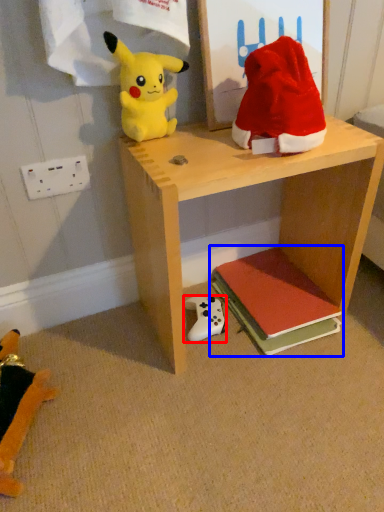
Question: Which object is closer to the camera taking this photo, toy (highlighted by a red box) or book (highlighted by a blue box)?

Choices:
 (A) toy
 (B) book

Answer: (B)